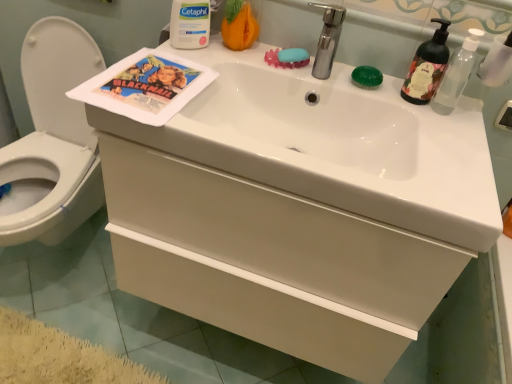
Identify the location of free space to the left of silver metallic faucet at upper center. This screenshot has height=384, width=512. (253, 63).